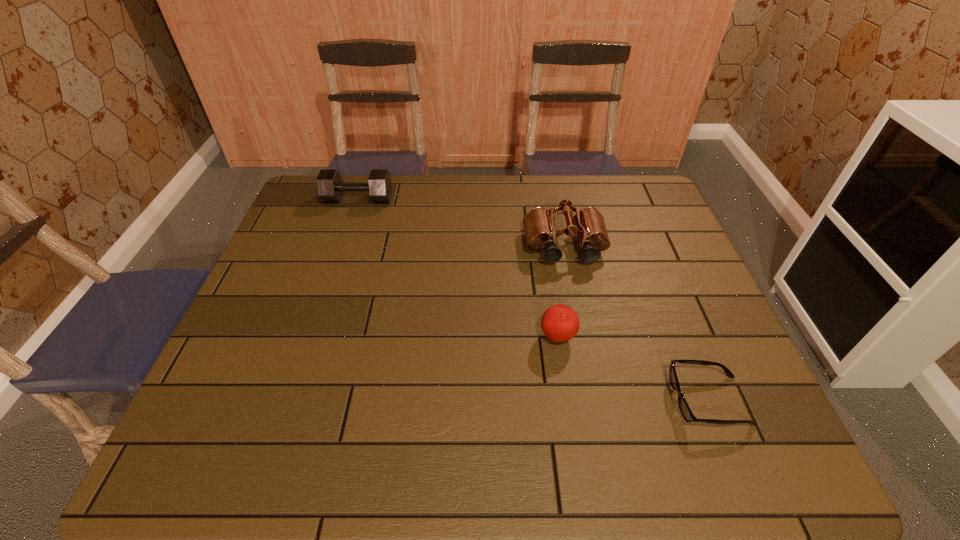
The width and height of the screenshot is (960, 540). Find the location of `blank region between the spectacles and the second nearest object`. blank region between the spectacles and the second nearest object is located at coordinates (633, 369).

Where is `free space between the apple and the spectacles`? free space between the apple and the spectacles is located at coordinates (633, 369).

Where is `vacant region between the apple and the rightmost object`? vacant region between the apple and the rightmost object is located at coordinates (633, 369).

Image resolution: width=960 pixels, height=540 pixels. Find the location of `free space between the tallest object and the farthest object`. free space between the tallest object and the farthest object is located at coordinates (462, 224).

Point out which object is positioned as the third nearest to the dumbbell. Please provide its 2D coordinates. Your answer should be formatted as a tuple, i.e. [(x, y)], where the tuple contains the x and y coordinates of a point satisfying the conditions above.

[(684, 408)]

The height and width of the screenshot is (540, 960). What are the coordinates of `object that is the closest to the binoculars` in the screenshot? It's located at tap(560, 323).

The height and width of the screenshot is (540, 960). I want to click on free location that satisfies the following two spatial constraints: 1. on the front side of the third farthest object; 2. on the right side of the dumbbell, so coord(312,337).

You are a GUI agent. You are given a task and a screenshot of the screen. Output one action in this format:
    pyautogui.click(x=<x>, y=<y>)
    Task: Click on the vacant space that satisfies the following two spatial constraints: 1. on the front side of the dumbbell; 2. on the right side of the third farthest object
    The height and width of the screenshot is (540, 960).
    Given the screenshot: What is the action you would take?
    pyautogui.click(x=312, y=337)